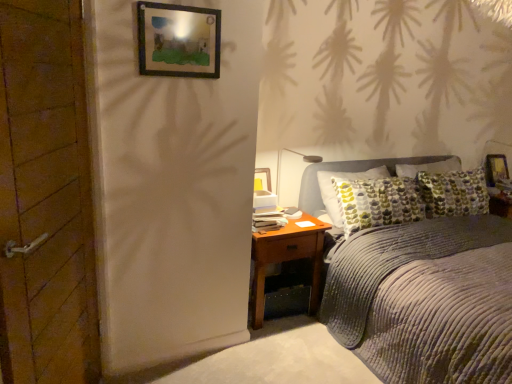
Question: From a real-world perspective, is corduroy gray bed at center beneath wooden framed picture at upper center, the 1th picture frame from the left?

Choices:
 (A) no
 (B) yes

Answer: (B)

Question: Can you confirm if corduroy gray bed at center is positioned to the left of wooden framed picture at upper center, positioned as the 2th picture frame in right-to-left order?

Choices:
 (A) yes
 (B) no

Answer: (B)

Question: Is the depth of corduroy gray bed at center less than that of wooden framed picture at upper center, the 1th picture frame from the left?

Choices:
 (A) yes
 (B) no

Answer: (A)

Question: Could you tell me if corduroy gray bed at center is facing wooden framed picture at upper center, the 1th picture frame from the left?

Choices:
 (A) no
 (B) yes

Answer: (A)

Question: Considering the relative sizes of corduroy gray bed at center and wooden framed picture at upper center, which is the 2th picture frame in bottom-to-top order, in the image provided, is corduroy gray bed at center shorter than wooden framed picture at upper center, which is the 2th picture frame in bottom-to-top order,?

Choices:
 (A) yes
 (B) no

Answer: (B)

Question: Is point (279, 170) positioned closer to the camera than point (269, 231)?

Choices:
 (A) closer
 (B) farther

Answer: (B)

Question: Considering the relative positions of white plastic lamp at center and brown wooden nightstand at lower right in the image provided, is white plastic lamp at center to the left or to the right of brown wooden nightstand at lower right?

Choices:
 (A) right
 (B) left

Answer: (A)

Question: From a real-world perspective, is white plastic lamp at center positioned above or below brown wooden nightstand at lower right?

Choices:
 (A) above
 (B) below

Answer: (A)

Question: Considering the positions of white plastic lamp at center and brown wooden nightstand at lower right in the image, is white plastic lamp at center wider or thinner than brown wooden nightstand at lower right?

Choices:
 (A) wide
 (B) thin

Answer: (B)

Question: Is point (200, 46) positioned closer to the camera than point (505, 173)?

Choices:
 (A) closer
 (B) farther

Answer: (A)

Question: Considering the positions of wooden framed picture at upper center, arranged as the first picture frame when viewed from the top, and wooden picture frame at upper right, which ranks as the 2th picture frame in front-to-back order, in the image, is wooden framed picture at upper center, arranged as the first picture frame when viewed from the top, wider or thinner than wooden picture frame at upper right, which ranks as the 2th picture frame in front-to-back order,?

Choices:
 (A) wide
 (B) thin

Answer: (B)

Question: Relative to wooden picture frame at upper right, the first picture frame positioned from the right, is wooden framed picture at upper center, the 1th picture frame from the left, in front or behind?

Choices:
 (A) front
 (B) behind

Answer: (A)

Question: From the image's perspective, is wooden framed picture at upper center, the 1th picture frame from the left, positioned above or below wooden picture frame at upper right, which ranks as the 2th picture frame in front-to-back order?

Choices:
 (A) below
 (B) above

Answer: (B)

Question: Considering the positions of wooden picture frame at upper right, placed as the 2th picture frame when sorted from left to right, and brown wooden nightstand at lower right in the image, is wooden picture frame at upper right, placed as the 2th picture frame when sorted from left to right, taller or shorter than brown wooden nightstand at lower right?

Choices:
 (A) tall
 (B) short

Answer: (B)

Question: Choose the correct answer: Is wooden picture frame at upper right, acting as the second picture frame starting from the top, inside brown wooden nightstand at lower right or outside it?

Choices:
 (A) outside
 (B) inside

Answer: (A)